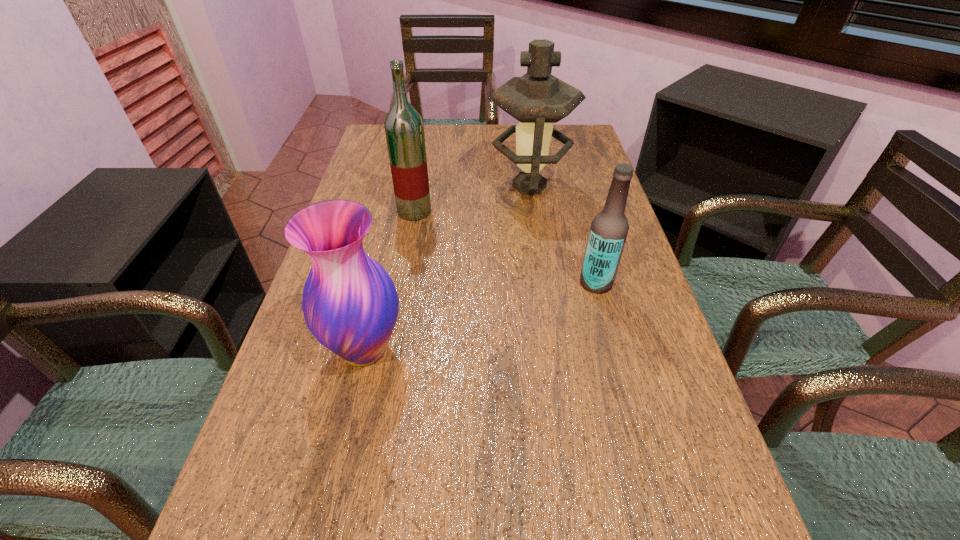
I want to click on vacant space in between the liquor and the oil lamp, so click(472, 199).

At what (x,y) coordinates should I click in order to perform the action: click on free spot between the oil lamp and the second nearest object. Please return your answer as a coordinate pair (x, y). Looking at the image, I should click on (563, 234).

The width and height of the screenshot is (960, 540). Identify the location of vacant area that lies between the liquor and the second nearest object. (505, 247).

You are a GUI agent. You are given a task and a screenshot of the screen. Output one action in this format:
    pyautogui.click(x=<x>, y=<y>)
    Task: Click on the object that stands as the third closest to the oil lamp
    The height and width of the screenshot is (540, 960).
    Given the screenshot: What is the action you would take?
    pyautogui.click(x=350, y=304)

At what (x,y) coordinates should I click in order to perform the action: click on object identified as the closest to the beer bottle. Please return your answer as a coordinate pair (x, y). Looking at the image, I should click on (537, 99).

Locate an element on the screen. The image size is (960, 540). free space that satisfies the following two spatial constraints: 1. on the back side of the liquor; 2. on the left side of the oil lamp is located at coordinates (419, 186).